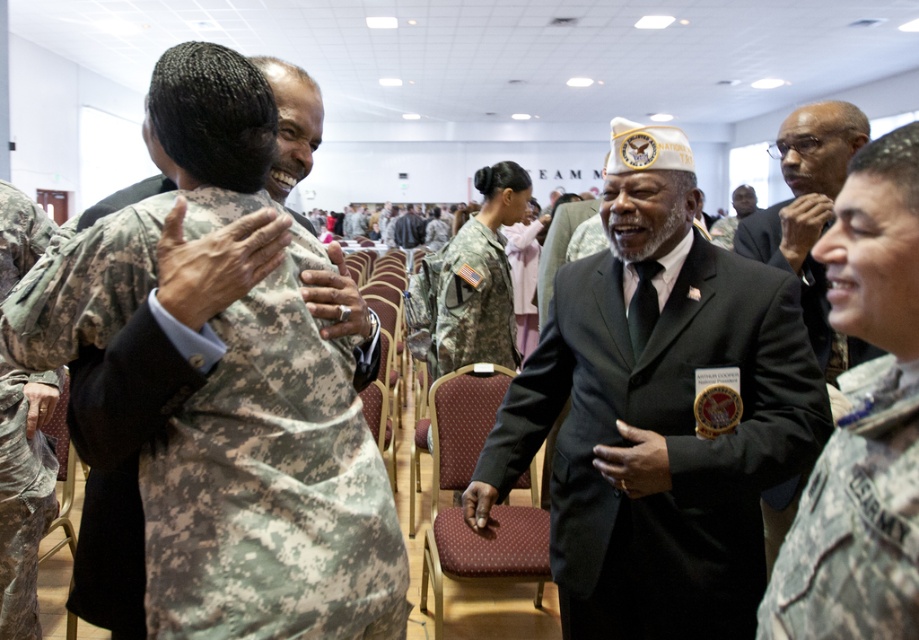
You are standing at the entrance of the room and want to sit down on the maroon fabric chair at center. Which direction should you walk to reach it?

The maroon fabric chair at center is located at point (x=466, y=484), so you should walk towards the center of the room to reach it.

You are a photographer standing at the entrance of the room. You want to take a photo of the maroon fabric chair at center and the camouflage uniform at center. Given that your camera has a maximum focus range of 8 meters, will both subjects be in focus?

The maroon fabric chair at center is 9.23 meters from camouflage uniform at center. Since the distance between them exceeds the camera focus range of 8 meters, the camera cannot focus on both subjects simultaneously.